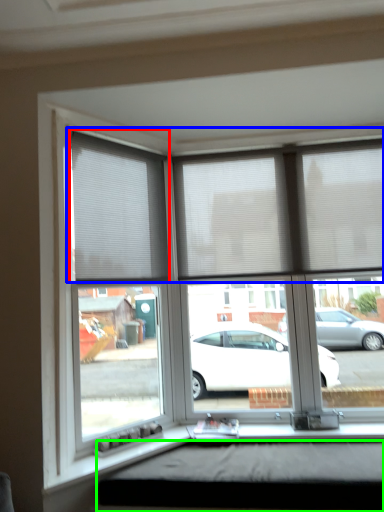
Question: Which object is the farthest from window blind (highlighted by a red box)? Choose among these: blind (highlighted by a blue box) or window box (highlighted by a green box).

Choices:
 (A) blind
 (B) window box

Answer: (B)